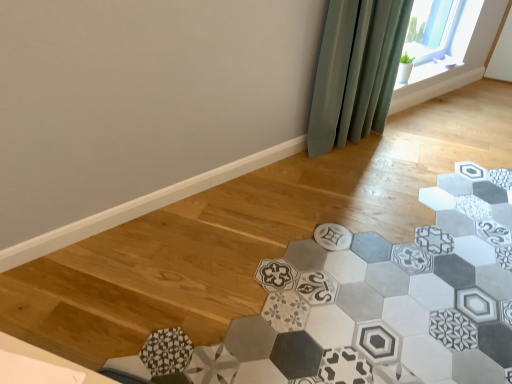
The height and width of the screenshot is (384, 512). Describe the element at coordinates (385, 300) in the screenshot. I see `patterned ceramic tile at center` at that location.

Image resolution: width=512 pixels, height=384 pixels. In order to click on patterned ceramic tile at center in this screenshot , I will do `click(385, 300)`.

What do you see at coordinates (356, 71) in the screenshot? I see `green fabric curtain at upper right` at bounding box center [356, 71].

Identify the location of green fabric curtain at upper right. This screenshot has height=384, width=512. (356, 71).

This screenshot has width=512, height=384. I want to click on patterned ceramic tile at center, so click(385, 300).

Based on their positions, is green fabric curtain at upper right located to the left or right of patterned ceramic tile at center?

green fabric curtain at upper right is positioned on patterned ceramic tile at center's right side.

Is green fabric curtain at upper right in front of or behind patterned ceramic tile at center in the image?

green fabric curtain at upper right is behind patterned ceramic tile at center.

Which is closer to the camera, (x=354, y=117) or (x=265, y=266)?

The point (x=265, y=266) is closer.

From the image's perspective, who appears lower, green fabric curtain at upper right or patterned ceramic tile at center?

patterned ceramic tile at center is shown below in the image.

From a real-world perspective, is green fabric curtain at upper right on patterned ceramic tile at center?

Yes, from a real-world perspective, green fabric curtain at upper right is above patterned ceramic tile at center.

Considering the relative sizes of green fabric curtain at upper right and patterned ceramic tile at center in the image provided, is green fabric curtain at upper right thinner than patterned ceramic tile at center?

Yes.

Based on the photo, which of these two, green fabric curtain at upper right or patterned ceramic tile at center, stands taller?

Standing taller between the two is green fabric curtain at upper right.

In the scene shown: Considering the relative sizes of green fabric curtain at upper right and patterned ceramic tile at center in the image provided, is green fabric curtain at upper right bigger than patterned ceramic tile at center?

Incorrect, green fabric curtain at upper right is not larger than patterned ceramic tile at center.

Is patterned ceramic tile at center a part of green fabric curtain at upper right?

No.

Is green fabric curtain at upper right not close to patterned ceramic tile at center?

No, there isn't a large distance between green fabric curtain at upper right and patterned ceramic tile at center.

Is green fabric curtain at upper right oriented away from patterned ceramic tile at center?

green fabric curtain at upper right is not turned away from patterned ceramic tile at center.

Looking at this image, how different are the orientations of green fabric curtain at upper right and patterned ceramic tile at center in degrees?

The angle between the facing direction of green fabric curtain at upper right and the facing direction of patterned ceramic tile at center is 144 degrees.

How far apart are green fabric curtain at upper right and patterned ceramic tile at center?

green fabric curtain at upper right and patterned ceramic tile at center are 36.18 inches apart.

Where is `ceramic tile below the green fabric curtain at upper right (from the image's perspective)`? ceramic tile below the green fabric curtain at upper right (from the image's perspective) is located at coordinates (385, 300).

Is patterned ceramic tile at center at the right side of green fabric curtain at upper right?

No, patterned ceramic tile at center is not to the right of green fabric curtain at upper right.

Relative to green fabric curtain at upper right, is patterned ceramic tile at center in front or behind?

patterned ceramic tile at center is in front of green fabric curtain at upper right.

Which is behind, point (223, 372) or point (347, 112)?

The point (347, 112) is behind.

From the image's perspective, which is above, patterned ceramic tile at center or green fabric curtain at upper right?

green fabric curtain at upper right.

From a real-world perspective, is patterned ceramic tile at center positioned under green fabric curtain at upper right based on gravity?

Yes.

Considering the relative sizes of patterned ceramic tile at center and green fabric curtain at upper right in the image provided, is patterned ceramic tile at center thinner than green fabric curtain at upper right?

No.

Which of these two, patterned ceramic tile at center or green fabric curtain at upper right, stands shorter?

patterned ceramic tile at center is shorter.

Can you confirm if patterned ceramic tile at center is bigger than green fabric curtain at upper right?

Yes, patterned ceramic tile at center is bigger than green fabric curtain at upper right.

Is patterned ceramic tile at center outside of green fabric curtain at upper right?

Indeed, patterned ceramic tile at center is completely outside green fabric curtain at upper right.

Are patterned ceramic tile at center and green fabric curtain at upper right far apart?

patterned ceramic tile at center is actually quite close to green fabric curtain at upper right.

Is green fabric curtain at upper right at the back of patterned ceramic tile at center?

No, patterned ceramic tile at center is not facing away from green fabric curtain at upper right.

The width and height of the screenshot is (512, 384). I want to click on curtain above the patterned ceramic tile at center (from a real-world perspective), so click(356, 71).

Locate an element on the screen. ceramic tile on the left side of green fabric curtain at upper right is located at coordinates (385, 300).

Locate an element on the screen. Image resolution: width=512 pixels, height=384 pixels. curtain on the right side of patterned ceramic tile at center is located at coordinates [x=356, y=71].